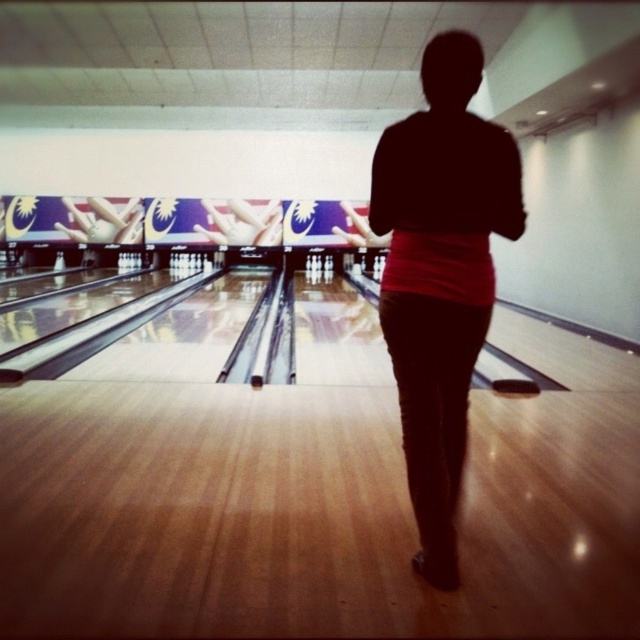
Question: Which object appears closest to the camera in this image?

Choices:
 (A) black matte shirt at center
 (B) white matte bowling ball at center

Answer: (A)

Question: Does black matte shirt at center lie behind white matte bowling ball at center?

Choices:
 (A) no
 (B) yes

Answer: (A)

Question: Is black matte shirt at center thinner than white matte bowling ball at center?

Choices:
 (A) yes
 (B) no

Answer: (A)

Question: Is black matte shirt at center wider than white matte bowling ball at center?

Choices:
 (A) yes
 (B) no

Answer: (B)